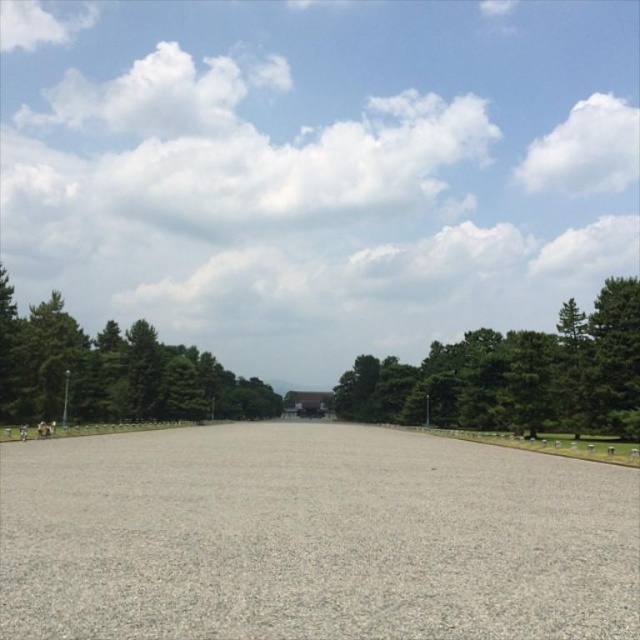
You are a landscape architect designing a walking path between the green leafy tree at center and the green leafy tree at upper center. If the path must be exactly 40 meters long, will it reach both trees?

The green leafy tree at center is 40.78 meters from the green leafy tree at upper center. Since the path is only 40 meters long, it will not reach both trees as the distance between them is longer than the path length.

In the scene shown: You are standing at the edge of the open paved area and see the gray gravel at center and the green leafy tree at center. Which object is closer to you?

The gray gravel at center is closer to you because it is in front of the green leafy tree at center.

You are standing at the starting point of the paved area and want to reach a destination marked by one of the two points. Which point, point (365,625) or point (436,400), is closer to you?

Point (365,625) is closer to the viewer than point (436,400), so you should choose point (365,625) as it is nearer to your current position.